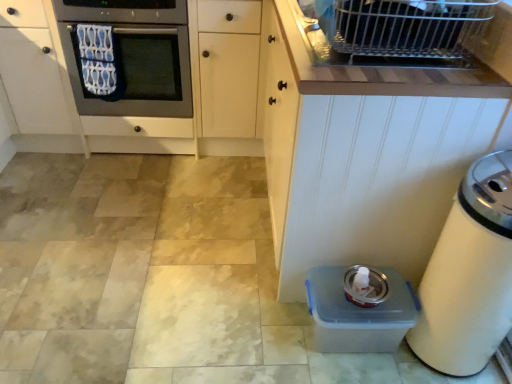
Question: Can you confirm if metallic gray oven at left is shorter than white plastic trash can at lower right?

Choices:
 (A) no
 (B) yes

Answer: (B)

Question: Is metallic gray oven at left next to white plastic trash can at lower right and touching it?

Choices:
 (A) no
 (B) yes

Answer: (A)

Question: Does metallic gray oven at left appear on the left side of white plastic trash can at lower right?

Choices:
 (A) yes
 (B) no

Answer: (A)

Question: Is metallic gray oven at left wider than white plastic trash can at lower right?

Choices:
 (A) no
 (B) yes

Answer: (B)

Question: Is metallic gray oven at left outside white plastic trash can at lower right?

Choices:
 (A) no
 (B) yes

Answer: (B)

Question: Could you tell me if metallic gray oven at left is facing white plastic trash can at lower right?

Choices:
 (A) yes
 (B) no

Answer: (B)

Question: Is clear plastic container at lower right at the back of white wood cabinet at lower right?

Choices:
 (A) yes
 (B) no

Answer: (B)

Question: From a real-world perspective, is white wood cabinet at lower right on top of clear plastic container at lower right?

Choices:
 (A) no
 (B) yes

Answer: (B)

Question: Does white wood cabinet at lower right appear on the left side of clear plastic container at lower right?

Choices:
 (A) yes
 (B) no

Answer: (A)

Question: Are white wood cabinet at lower right and clear plastic container at lower right located far from each other?

Choices:
 (A) no
 (B) yes

Answer: (A)

Question: From the image's perspective, does white wood cabinet at lower right appear lower than clear plastic container at lower right?

Choices:
 (A) no
 (B) yes

Answer: (A)

Question: Would you say clear plastic container at lower right is part of white wood cabinet at lower right's contents?

Choices:
 (A) yes
 (B) no

Answer: (B)

Question: From the image's perspective, is clear plastic container at lower right on white wood cabinet at lower right?

Choices:
 (A) no
 (B) yes

Answer: (A)